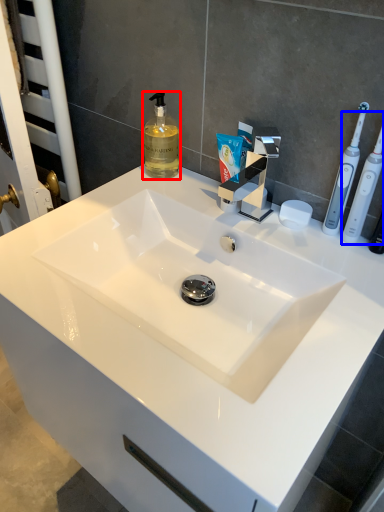
Question: Which object appears farthest to the camera in this image, soap dispenser (highlighted by a red box) or toothbrush (highlighted by a blue box)?

Choices:
 (A) soap dispenser
 (B) toothbrush

Answer: (A)